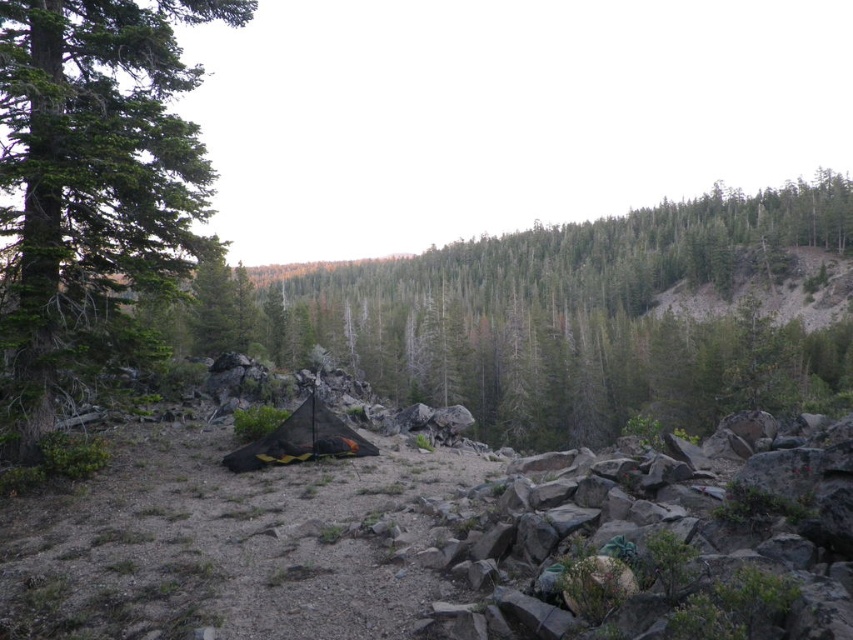
Consider the image. Which of these two, green textured tree at left or black mesh tent at center, stands taller?

green textured tree at left

Who is more distant from viewer, (71,56) or (321,412)?

Positioned behind is point (321,412).

At what (x,y) coordinates should I click in order to perform the action: click on green textured tree at left. Please return your answer as a coordinate pair (x, y). The height and width of the screenshot is (640, 853). Looking at the image, I should click on (93, 164).

Between point (839, 179) and point (144, 38), which one is positioned behind?

The point (839, 179) is more distant.

Is green matte tent at center smaller than green textured tree at left?

Actually, green matte tent at center might be larger than green textured tree at left.

Between point (323, 333) and point (140, 227), which one is positioned behind?

Point (323, 333)

The height and width of the screenshot is (640, 853). I want to click on green matte tent at center, so click(x=578, y=317).

Measure the distance between green matte tent at center and camera.

green matte tent at center and camera are 40.43 meters apart.

Is green matte tent at center to the left of black mesh tent at center from the viewer's perspective?

Incorrect, green matte tent at center is not on the left side of black mesh tent at center.

Is point (729, 230) in front of point (252, 456)?

No, (729, 230) is further to viewer.

Locate an element on the screen. green matte tent at center is located at coordinates (578, 317).